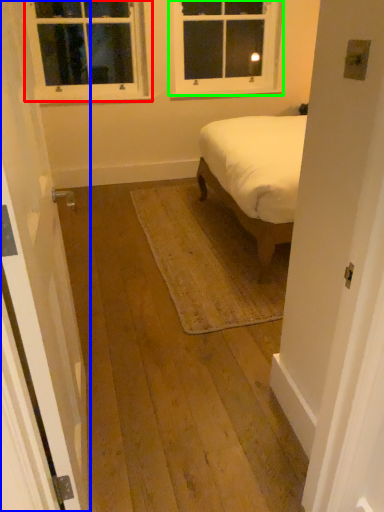
Question: Estimate the real-world distances between objects in this image. Which object is closer to window (highlighted by a red box), door (highlighted by a blue box) or window (highlighted by a green box)?

Choices:
 (A) door
 (B) window

Answer: (B)